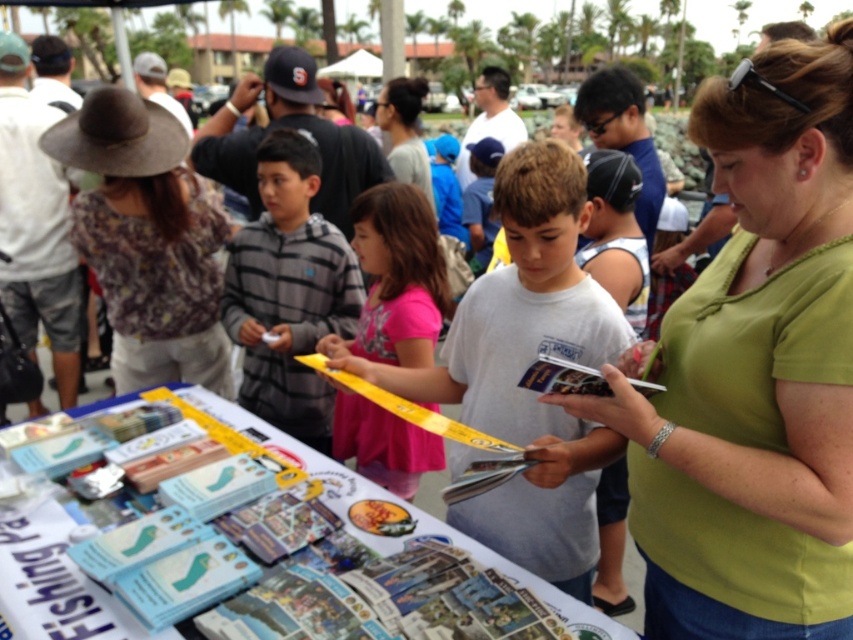
Question: Is white cotton shirt at center positioned at the back of pink matte shirt at center?

Choices:
 (A) yes
 (B) no

Answer: (B)

Question: Where is brown woven hat at upper left located in relation to pink matte shirt at center in the image?

Choices:
 (A) above
 (B) below

Answer: (A)

Question: Which of the following is the farthest from the observer?

Choices:
 (A) gray matte shirt at center
 (B) pink matte shirt at center
 (C) gray striped sweater at center
 (D) white cotton shirt at center

Answer: (A)

Question: Which object is the farthest from the white cotton shirt at center?

Choices:
 (A) brown woven hat at upper left
 (B) gray striped sweater at center
 (C) gray matte shirt at center

Answer: (C)

Question: Which point is farther to the camera?

Choices:
 (A) white cotton shirt at center
 (B) green matte shirt at center
 (C) pink matte shirt at center
 (D) gray striped sweater at center

Answer: (D)

Question: Is green matte shirt at center bigger than white cotton shirt at center?

Choices:
 (A) no
 (B) yes

Answer: (B)